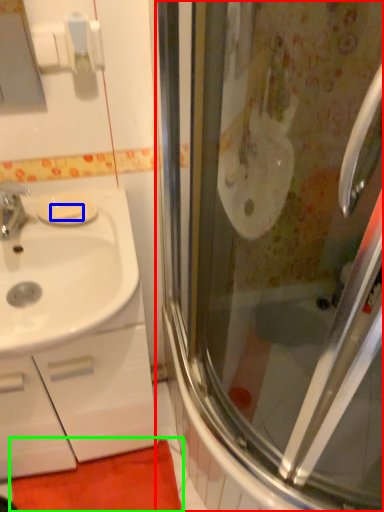
Question: Based on their relative distances, which object is nearer to screen door (highlighted by a red box)? Choose from soap (highlighted by a blue box) and bath mat (highlighted by a green box).

Choices:
 (A) soap
 (B) bath mat

Answer: (B)